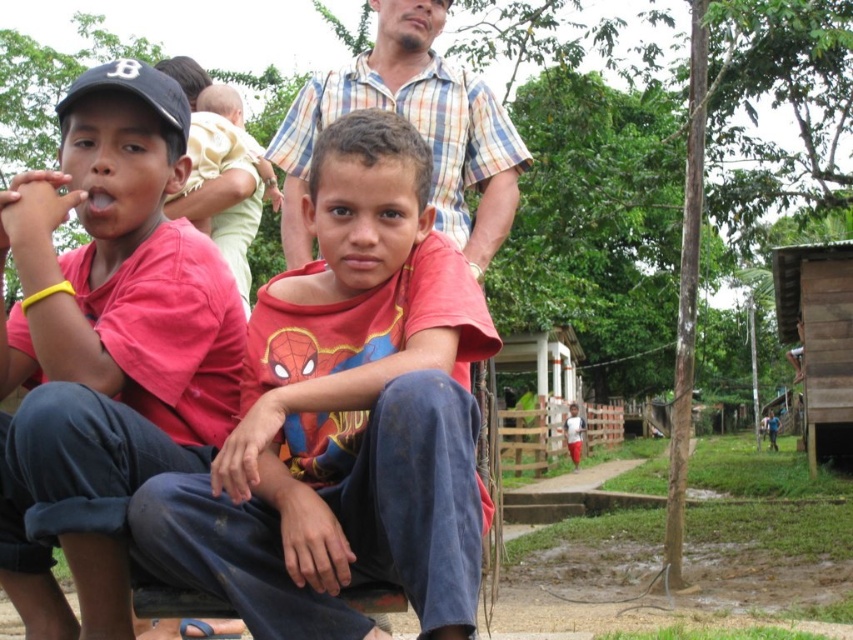
You are a clothing store employee who needs to display two red shirts. The shirts are the matte red shirt at center and the matte red shirt at left. According to the image, which shirt should be placed on the larger mannequin?

The matte red shirt at center should be placed on the larger mannequin because it is larger in size than the matte red shirt at left.

You are a photographer trying to capture a candid shot of the matte red shirt at left. You are currently positioned at point (106, 348). Can you confirm if the matte red shirt at left is directly in front of you?

The matte red shirt at left is located at point (106, 348), so yes, it is directly in front of you.